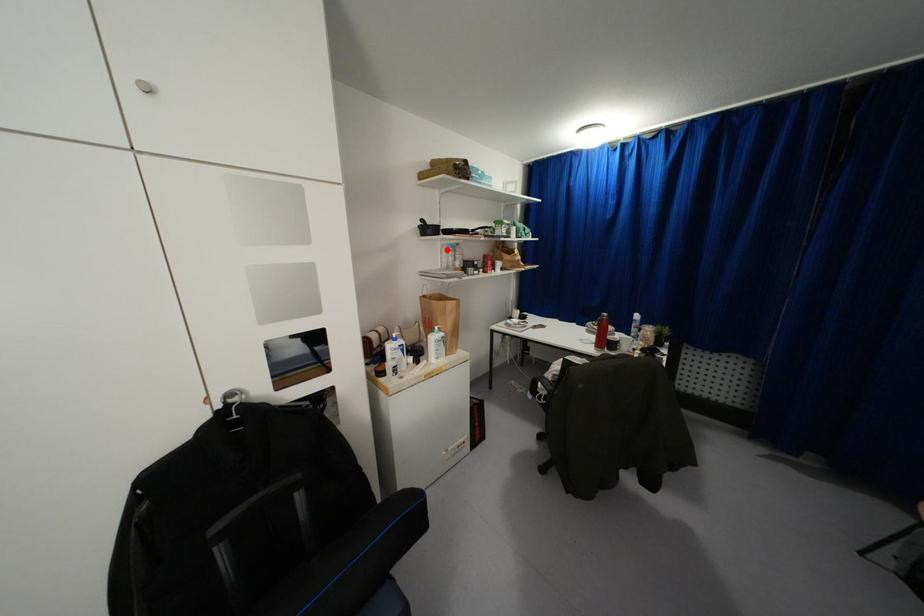
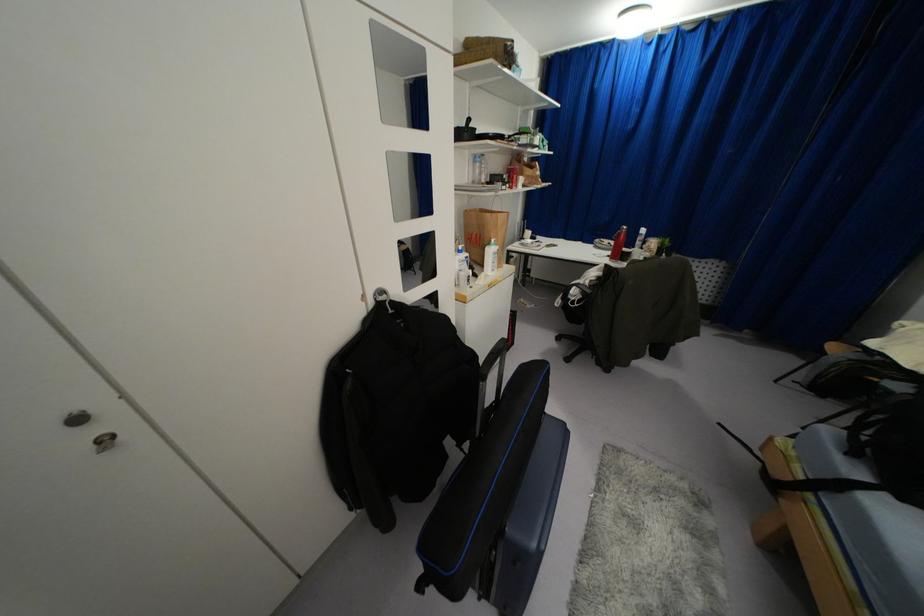
In the second image, find the point that corresponds to the highlighted location in the first image.

(475, 161)